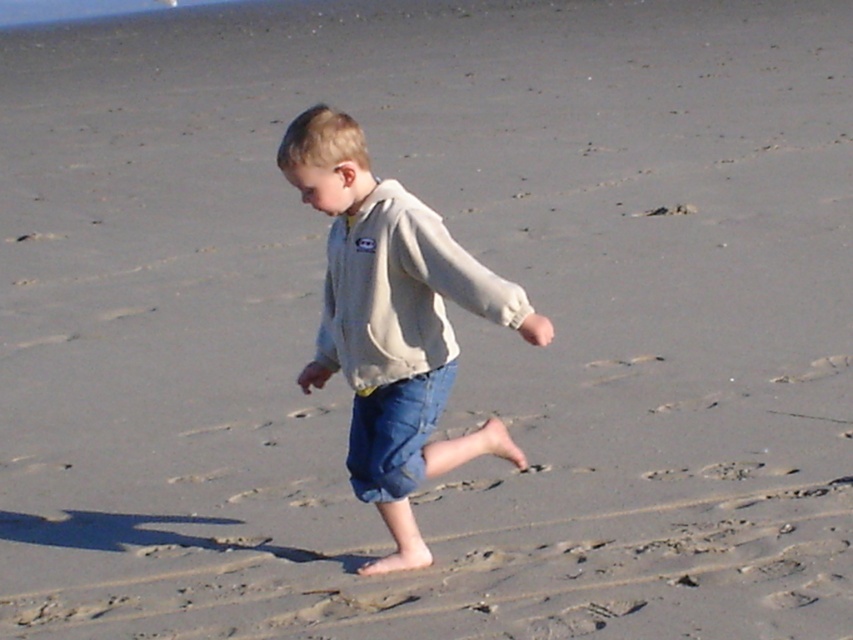
You are a fashion designer observing a child wearing both the light beige fleece jacket at center and the beige fleece sweatshirt at center. Which clothing item is longer in length?

The light beige fleece jacket at center is much taller than the beige fleece sweatshirt at center, so the jacket is longer in length.

You are a parent trying to find your child who is wearing a light beige fleece jacket at center and a beige fleece sweatshirt at center on the beach. If you see both items, how far apart are they?

The distance between the light beige fleece jacket at center and the beige fleece sweatshirt at center is 12.19 centimeters.